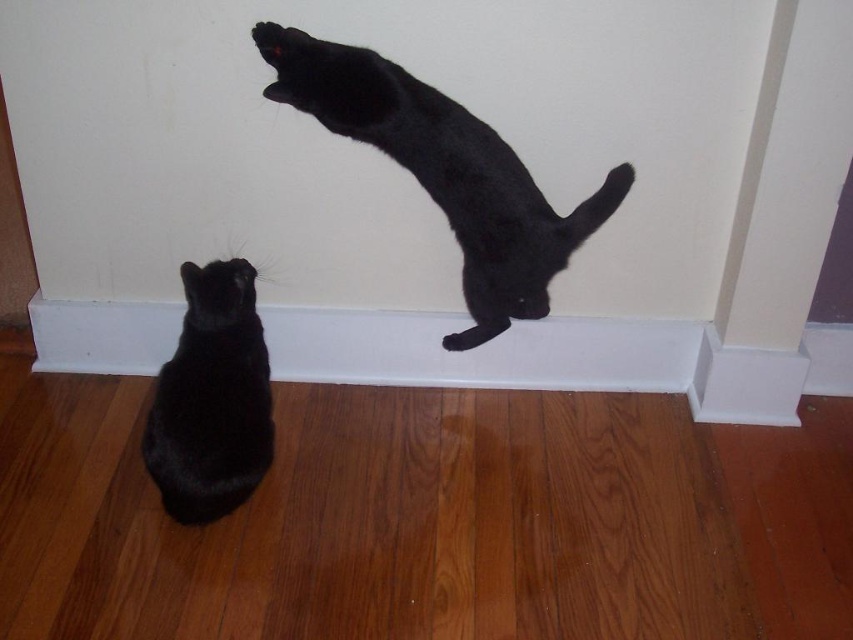
Question: Can you confirm if black matte cat at upper center is smaller than matte black cat at lower left?

Choices:
 (A) yes
 (B) no

Answer: (B)

Question: Is black matte cat at upper center below matte black cat at lower left?

Choices:
 (A) yes
 (B) no

Answer: (B)

Question: Can you confirm if black matte cat at upper center is positioned to the left of matte black cat at lower left?

Choices:
 (A) yes
 (B) no

Answer: (B)

Question: Which point is farther to the camera?

Choices:
 (A) black matte cat at upper center
 (B) matte black cat at lower left

Answer: (B)

Question: Which object appears farthest from the camera in this image?

Choices:
 (A) black matte cat at upper center
 (B) matte black cat at lower left

Answer: (B)